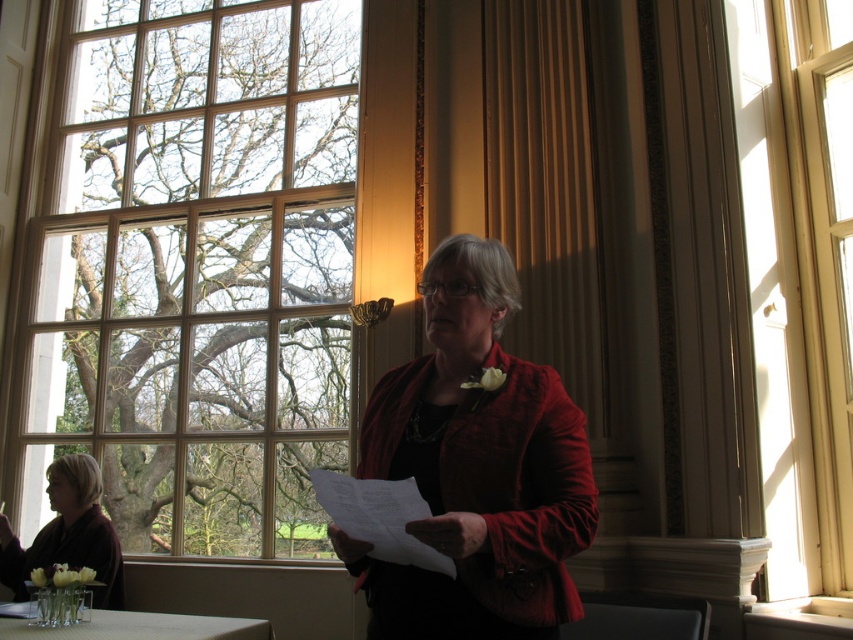
Question: Which object appears closest to the camera in this image?

Choices:
 (A) white glossy table at lower left
 (B) clear glass window at upper left

Answer: (A)

Question: Considering the relative positions of matte brown blazer at lower left and white glossy table at lower left in the image provided, where is matte brown blazer at lower left located with respect to white glossy table at lower left?

Choices:
 (A) below
 (B) above

Answer: (B)

Question: Is matte red jacket at center wider than matte brown blazer at lower left?

Choices:
 (A) yes
 (B) no

Answer: (B)

Question: Among these points, which one is nearest to the camera?

Choices:
 (A) (74, 490)
 (B) (479, 474)

Answer: (B)

Question: Can you confirm if matte brown blazer at lower left is thinner than white glossy table at lower left?

Choices:
 (A) yes
 (B) no

Answer: (A)

Question: Which is nearer to the white glossy table at lower left?

Choices:
 (A) wooden frame window at right
 (B) white paper at center

Answer: (B)